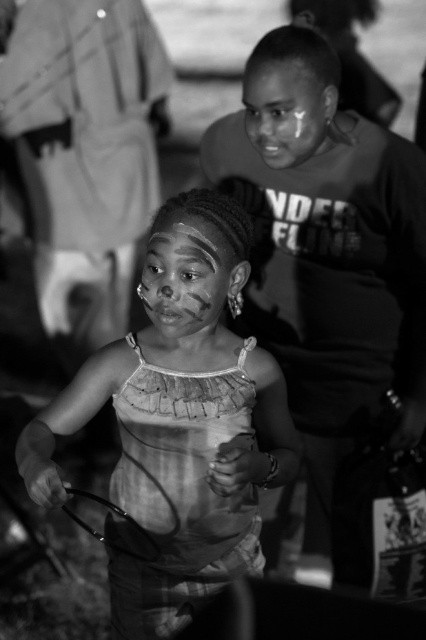
Question: Among these points, which one is nearest to the camera?

Choices:
 (A) (216, 321)
 (B) (242, 509)
 (C) (342, 282)
 (D) (271, 65)

Answer: (A)

Question: Does smooth skin boy at center have a greater width compared to matte fabric dress at center?

Choices:
 (A) yes
 (B) no

Answer: (B)

Question: Is matte fabric dress at center to the right of matte skin face at upper center from the viewer's perspective?

Choices:
 (A) yes
 (B) no

Answer: (B)

Question: Is smooth skin boy at center behind matte painted face at center?

Choices:
 (A) no
 (B) yes

Answer: (B)

Question: Among these points, which one is nearest to the camera?

Choices:
 (A) (258, 406)
 (B) (282, 145)
 (C) (386, 320)
 (D) (173, 300)

Answer: (D)

Question: Which object is positioned farthest from the matte fabric dress at center?

Choices:
 (A) matte painted face at center
 (B) smooth skin boy at center

Answer: (B)